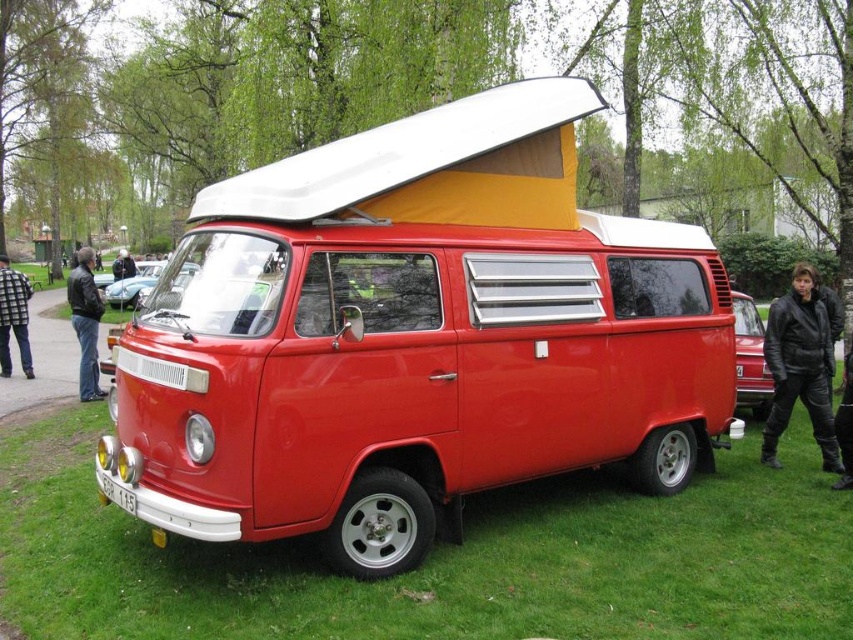
In the scene shown: You are standing in front of the red Volkswagen camper van and want to place a small potted plant between the shiny black car at right and the leather jacket at left. Which object should you place the plant closer to if you want it to be nearer to the viewer?

You should place the small potted plant closer to the shiny black car at right because it is closer to the viewer than the leather jacket at left.

You are organizing a car show and need to place two jackets in the van. The jackets are the black leather jacket at lower right and the leather jacket at left. Which jacket is shorter in height?

The black leather jacket at lower right has a lesser height compared to the leather jacket at left, so the black leather jacket at lower right is shorter.

You are standing next to the classic red Volkswagen camper van and notice a leather jacket at left and a shiny chrome mirror at center. Which object is closer to you?

The leather jacket at left is closer to you because the shiny chrome mirror at center is behind it.